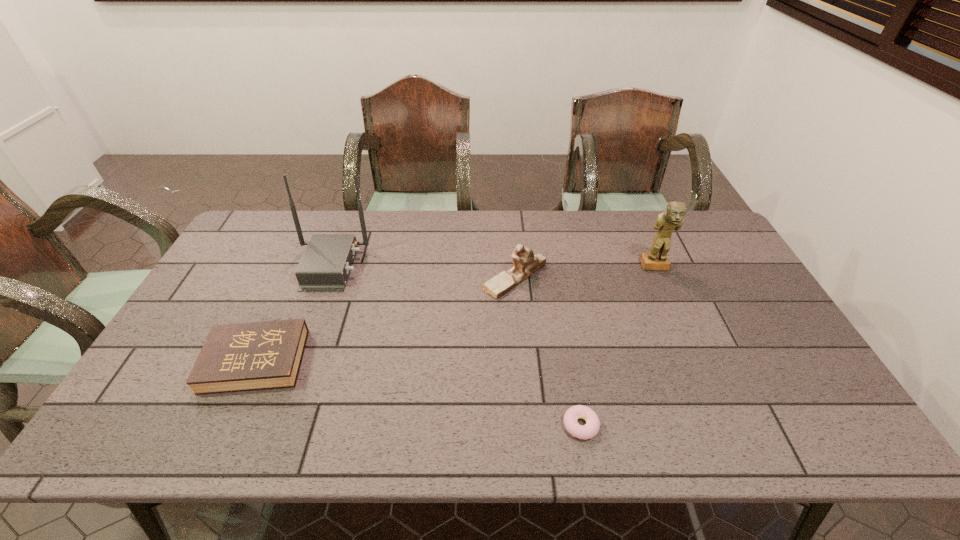
This screenshot has height=540, width=960. In order to click on free region located 0.110m on the front-facing side of the rightmost object in this screenshot , I will do `click(668, 299)`.

I want to click on free space located on the front-facing side of the left figurine, so click(366, 278).

Locate an element on the screen. This screenshot has height=540, width=960. vacant region located 0.220m on the front-facing side of the left figurine is located at coordinates (412, 278).

Where is `free space located on the front-facing side of the left figurine`? This screenshot has width=960, height=540. free space located on the front-facing side of the left figurine is located at coordinates (431, 278).

The image size is (960, 540). In order to click on blank space located 0.090m on the right of the fourth farthest object in this screenshot , I will do `click(340, 361)`.

You are a GUI agent. You are given a task and a screenshot of the screen. Output one action in this format:
    pyautogui.click(x=<x>, y=<y>)
    Task: Click on the vacant space located on the back of the shortest object
    The image size is (960, 540).
    Given the screenshot: What is the action you would take?
    pyautogui.click(x=566, y=345)

This screenshot has height=540, width=960. What are the coordinates of `object situated at the far edge` in the screenshot? It's located at point(326,262).

What are the coordinates of `object at the near edge` in the screenshot? It's located at (592, 426).

I want to click on object present at the left edge, so (x=235, y=357).

The image size is (960, 540). Identify the location of vacant space at the far edge of the desktop. (305, 230).